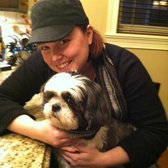
What are the coordinates of `window` in the screenshot? It's located at pos(140,15).